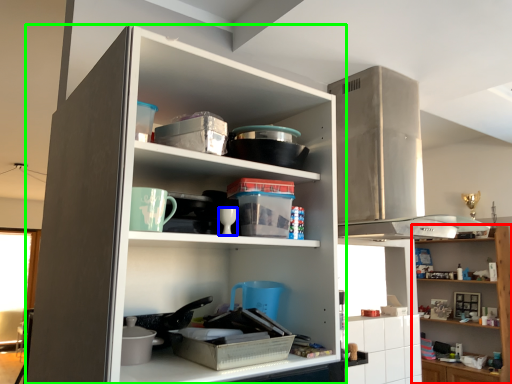
Question: Considering the real-world distances, which object is farthest from shelf (highlighted by a red box)? tableware (highlighted by a blue box) or cupboard (highlighted by a green box)?

Choices:
 (A) tableware
 (B) cupboard

Answer: (A)